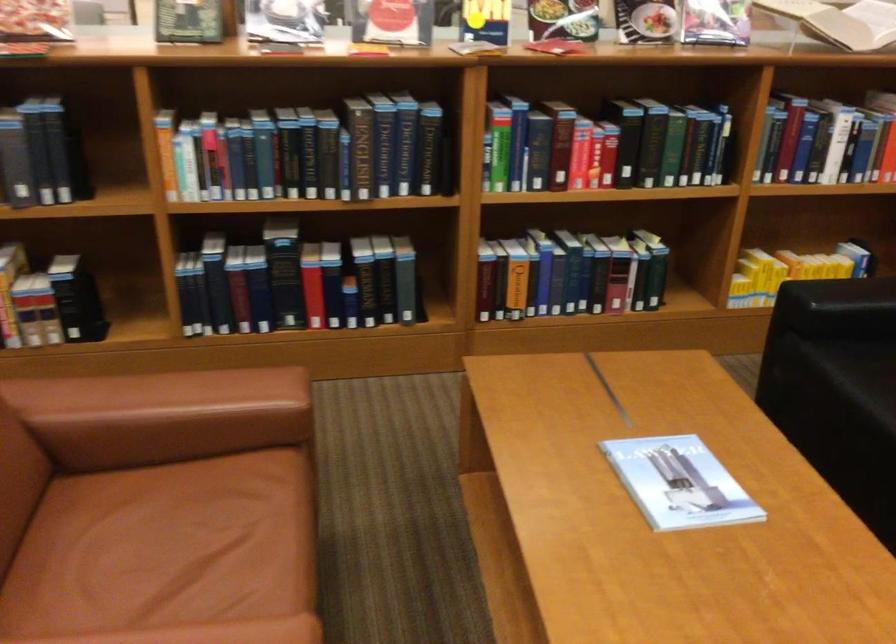
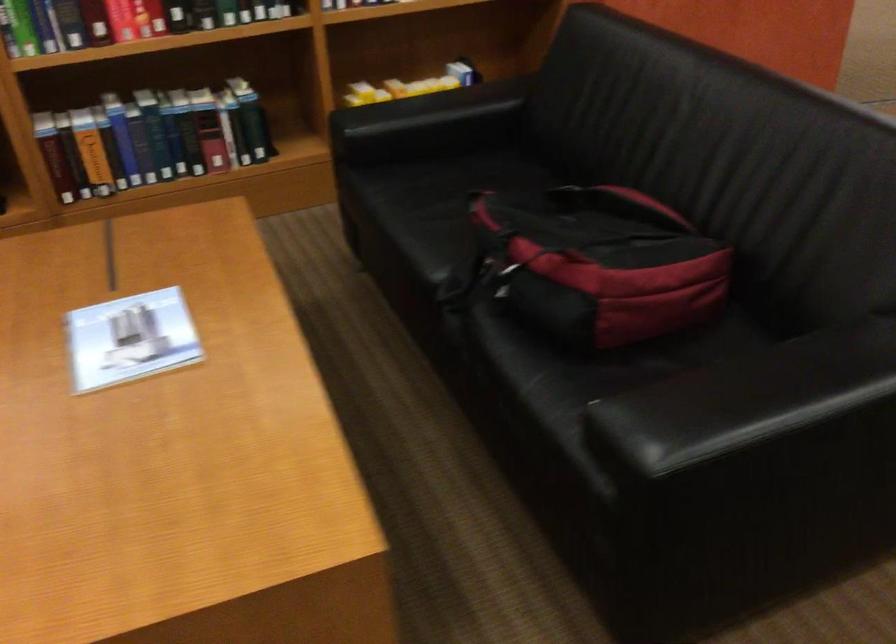
Question: The images are taken continuously from a first-person perspective. In which direction is your viewpoint rotating?

Choices:
 (A) Left
 (B) Right
 (C) Up
 (D) Down

Answer: (B)